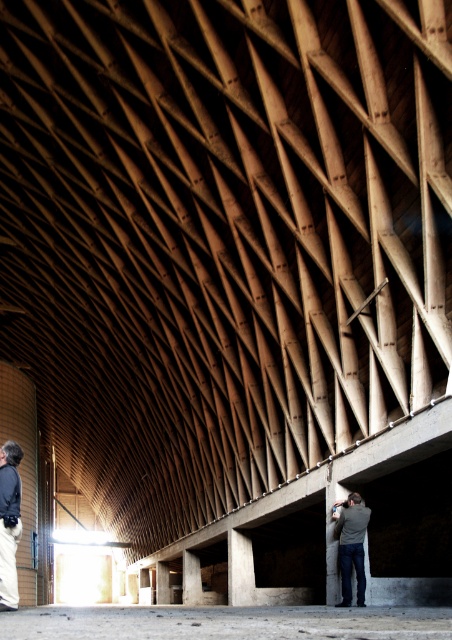
You are a tailor who needs to determine which jacket takes up more horizontal space. You see the dark gray jacket at lower left and the gray fabric jacket at lower center. Which one is wider?

The gray fabric jacket at lower center is wider than the dark gray jacket at lower left.